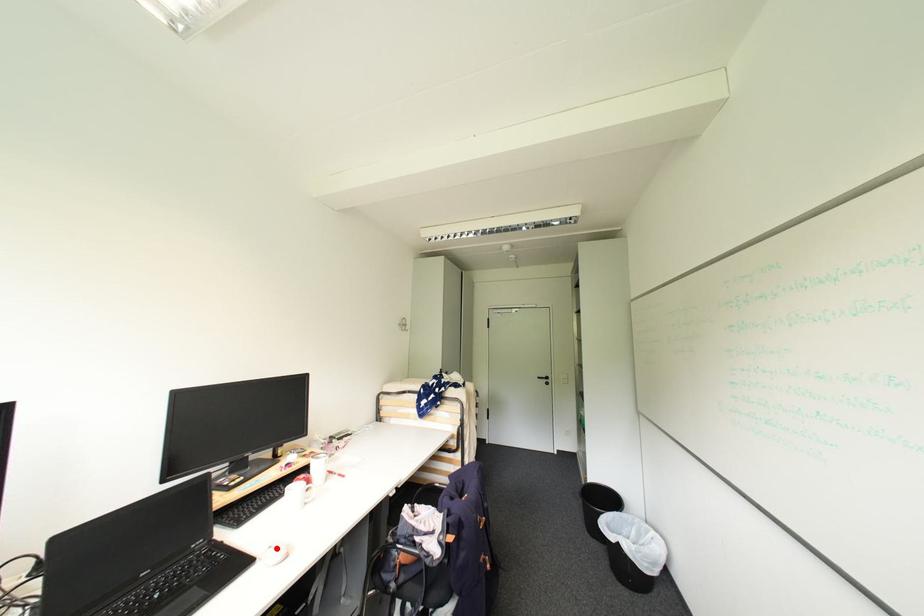
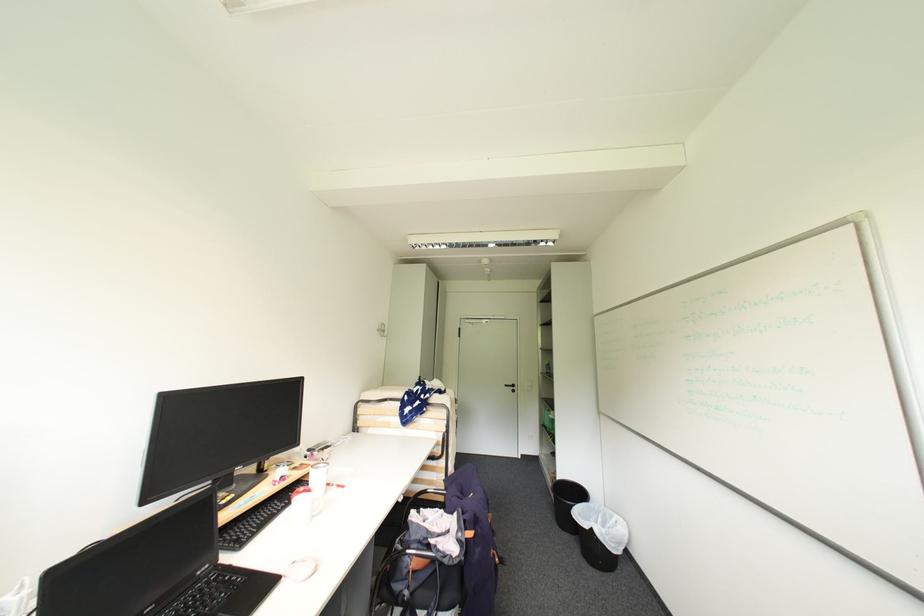
In the second image, find the point that corresponds to the highlighted location in the first image.

(300, 564)